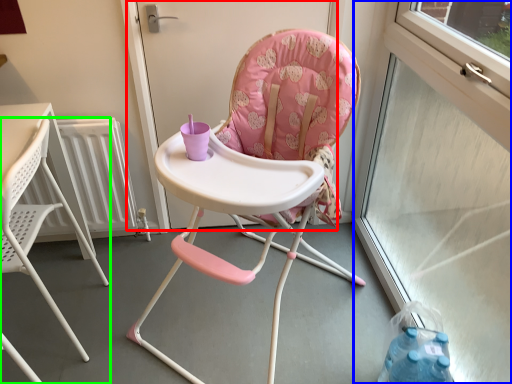
Question: Which object is positioned closest to screen door (highlighted by a red box)? Select from window screen (highlighted by a blue box) and chair (highlighted by a green box).

Choices:
 (A) window screen
 (B) chair

Answer: (B)